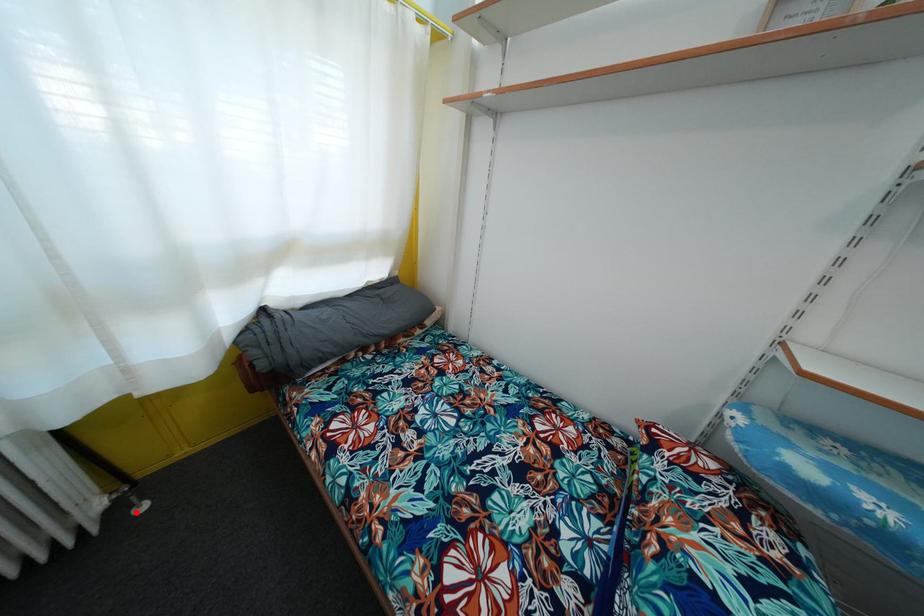
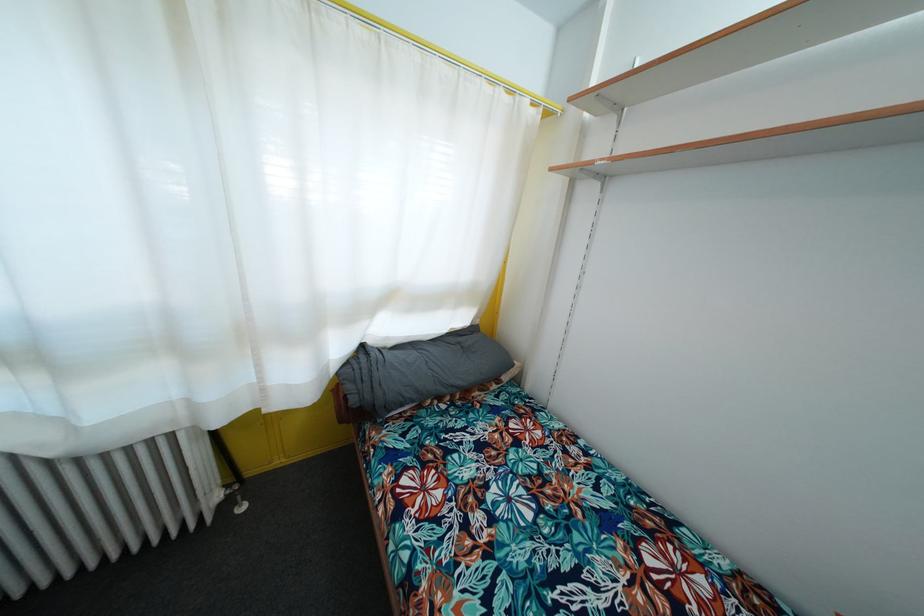
Find the pixel in the second image that matches the highlighted location in the first image.

(240, 511)